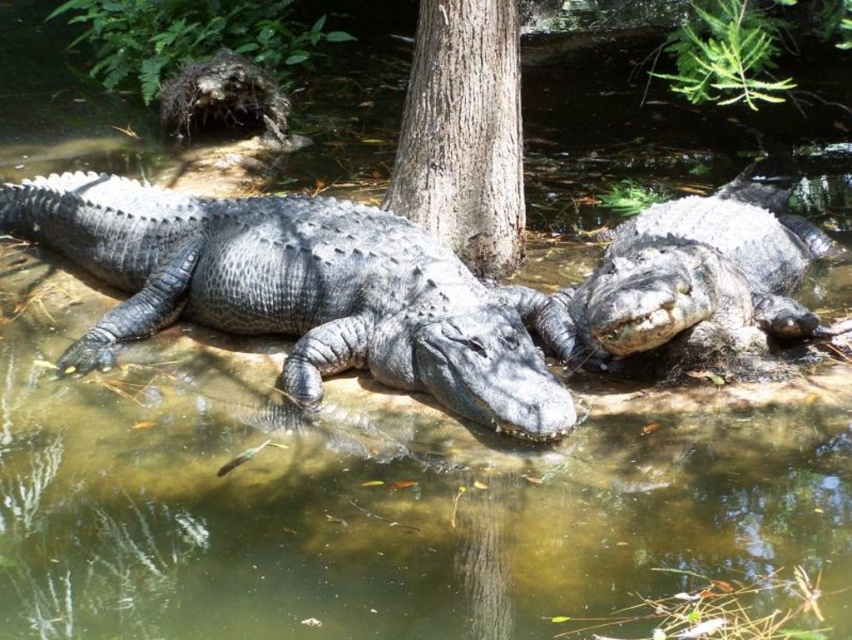
Does point (73, 364) come behind point (490, 225)?

That is False.

Who is lower down, slick gray crocodile at center or smooth gray tree trunk at center?

slick gray crocodile at center is below.

This screenshot has height=640, width=852. What are the coordinates of `slick gray crocodile at center` in the screenshot? It's located at (304, 291).

Looking at this image, does slick gray crocodile at center come in front of gray rough skin crocodile at right?

That is True.

Does slick gray crocodile at center have a lesser height compared to gray rough skin crocodile at right?

Incorrect, slick gray crocodile at center's height does not fall short of gray rough skin crocodile at right's.

I want to click on slick gray crocodile at center, so click(304, 291).

Consider the image. Who is taller, gray rough skin crocodile at right or smooth gray tree trunk at center?

With more height is smooth gray tree trunk at center.

Between gray rough skin crocodile at right and smooth gray tree trunk at center, which one is positioned higher?

Positioned higher is smooth gray tree trunk at center.

Is point (692, 234) positioned behind point (502, 148)?

No, it is in front of (502, 148).

I want to click on gray rough skin crocodile at right, so click(x=701, y=276).